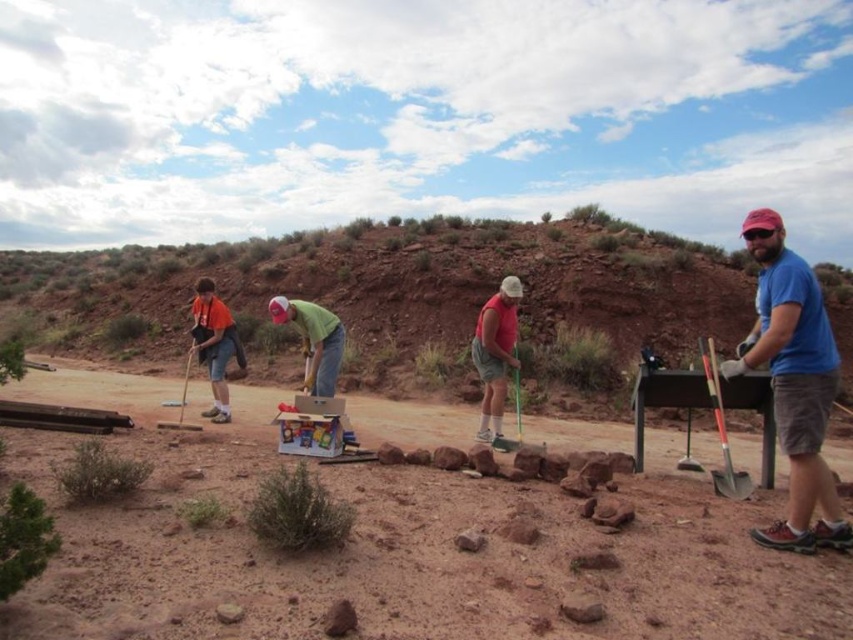
Who is positioned more to the right, matte red shirt at center or green matte shirt at center?

matte red shirt at center

Is matte red shirt at center below green matte shirt at center?

Yes.

I want to click on matte red shirt at center, so click(x=495, y=355).

The width and height of the screenshot is (853, 640). What are the coordinates of `matte red shirt at center` in the screenshot? It's located at (495, 355).

Is brown sandy dirt at center thinner than matte red shirt at center?

Indeed, brown sandy dirt at center has a lesser width compared to matte red shirt at center.

Locate an element on the screen. This screenshot has height=640, width=853. brown sandy dirt at center is located at coordinates click(x=409, y=548).

Does point (732, 612) come in front of point (509, 364)?

Yes, it is in front of point (509, 364).

In order to click on brown sandy dirt at center in this screenshot , I will do `click(409, 548)`.

Between brown sandy dirt at center and shiny silver shovel at right, which one appears on the right side from the viewer's perspective?

Positioned to the right is shiny silver shovel at right.

Where is `brown sandy dirt at center`? This screenshot has height=640, width=853. brown sandy dirt at center is located at coordinates (409, 548).

Where is `brown sandy dirt at center`? Image resolution: width=853 pixels, height=640 pixels. brown sandy dirt at center is located at coordinates (409, 548).